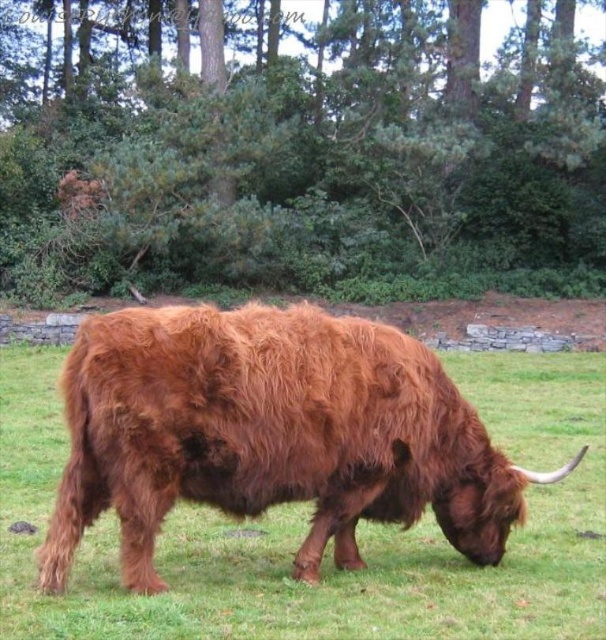
You are a painter setting up your easel to paint the Highland cow scene. You want to ensure the green leafy tree at center and the brown fuzzy bull at center are both visible in your painting. Which object should you place wider in your painting to match their actual sizes?

The green leafy tree at center should be placed wider in the painting because it might be wider than the brown fuzzy bull at center according to the scene description.

You are a hiker standing at the edge of the field where the brown fuzzy bull at center is grazing. You want to walk to the green leafy tree at center without getting too close to the bull. Can you safely walk directly between them?

The distance between the green leafy tree at center and the brown fuzzy bull at center is 23.52 meters. Since you want to stay away from the bull, walking directly between them would keep you at least 23.52 meters away from the bull, which is safe.

You are a photographer trying to capture a photo of the brown fuzzy bull at center. You notice the green leafy tree at center is blocking part of the bull. Can you move to the left or right to avoid the tree while still keeping the bull in the frame?

The green leafy tree at center is taller than the brown fuzzy bull at center. Moving to the left or right may allow you to position yourself so the tree is no longer blocking the bull, but since both are at the center, you might need to adjust your angle carefully to keep the bull in view while avoiding the tree.